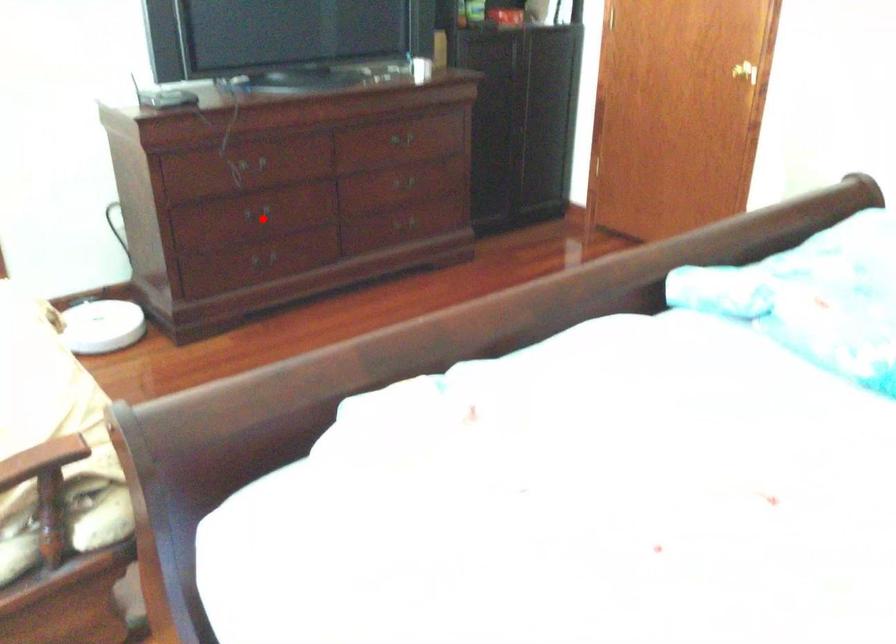
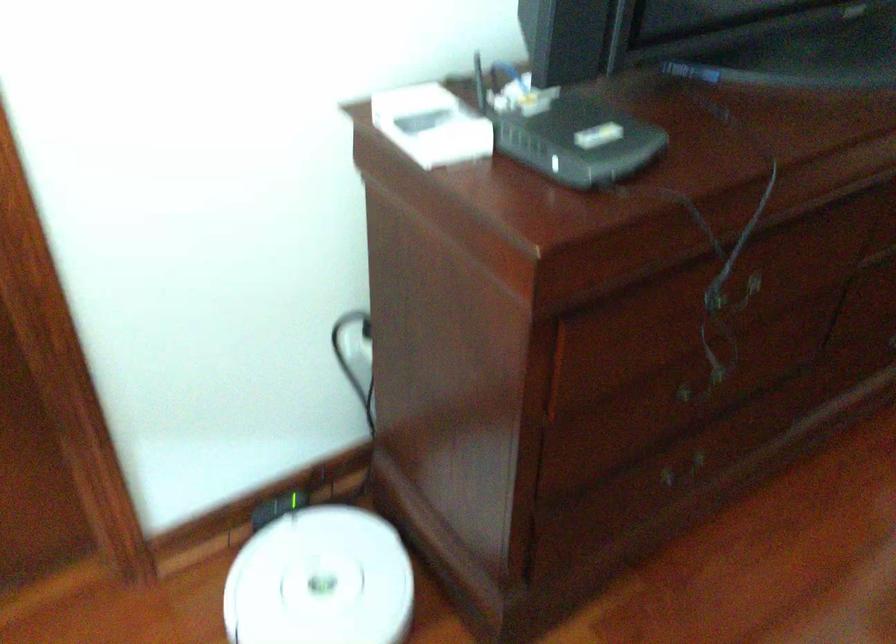
Question: I am providing you with two images of the same scene from different viewpoints. Given a red point in image1, look at the same physical point in image2. Is it:

Choices:
 (A) Closer to the viewpoint
 (B) Farther from the viewpoint

Answer: (A)